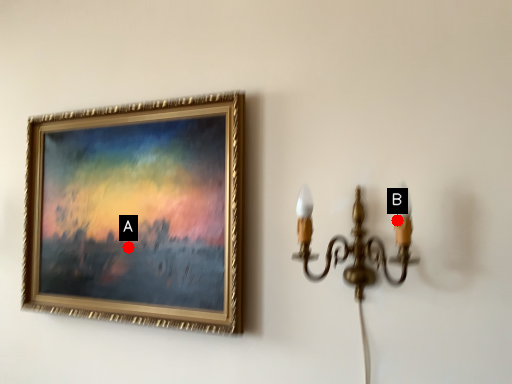
Question: Two points are circled on the image, labeled by A and B beside each circle. Which point is further to the camera?

Choices:
 (A) A is further
 (B) B is further

Answer: (A)